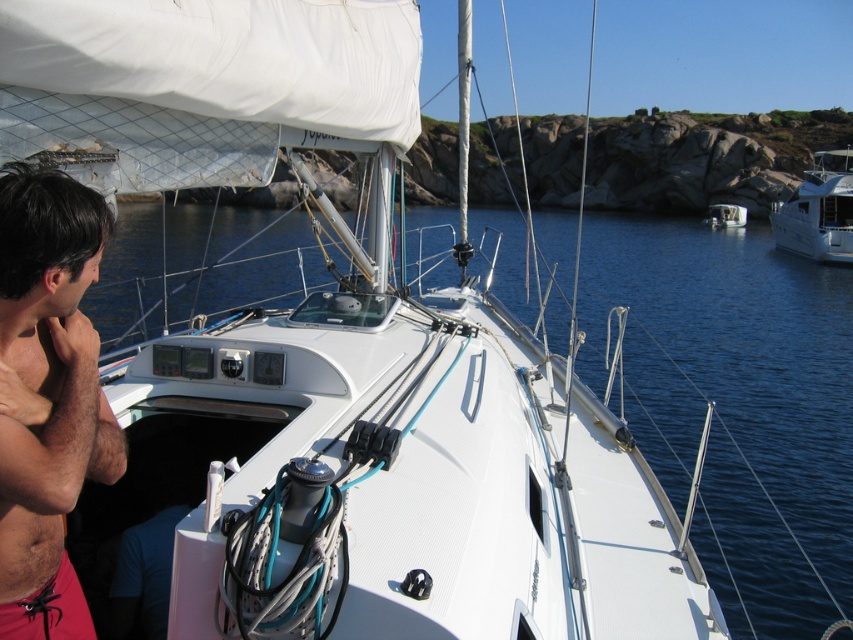
You are a photographer planning to take a portrait of someone standing on the deck of the white glossy boat at center. You notice the shiny black hair at left in the frame. Considering their widths, which object would appear narrower in the photo?

The shiny black hair at left would appear narrower in the photo since its width is less than the white glossy boat at center.

You are standing on the deck of the sailboat and want to take a photo of both the point at coordinates point (0, 364) and point (792, 204). Which point should you focus on first to ensure both are in clear view?

You should focus on point (0, 364) first since it is closer to the camera than point (792, 204), ensuring both points are in clear view.